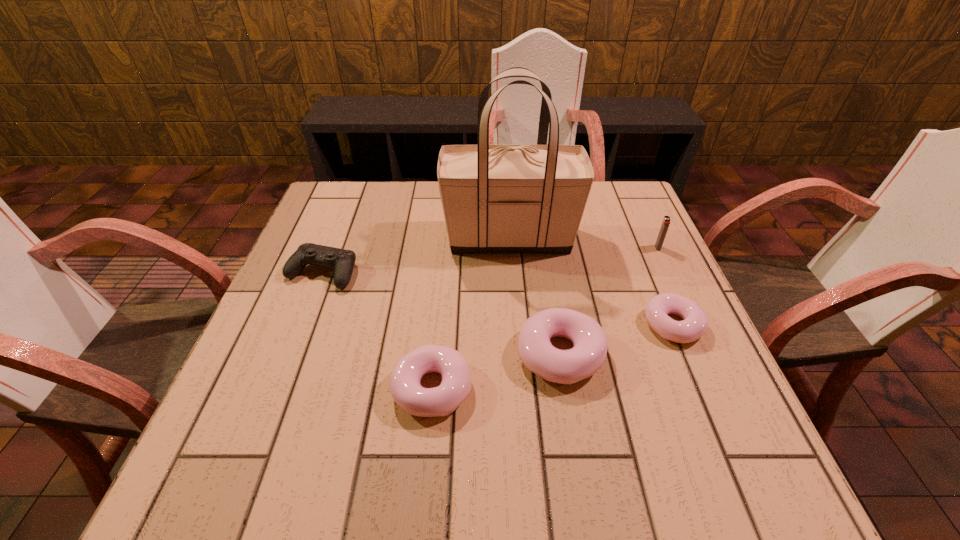
Where is `free space that satisfies the following two spatial constraints: 1. on the back side of the igniter; 2. with handles facing forward on the tallest object`? free space that satisfies the following two spatial constraints: 1. on the back side of the igniter; 2. with handles facing forward on the tallest object is located at coordinates (654, 239).

At what (x,y) coordinates should I click in order to perform the action: click on vacant region that satisfies the following two spatial constraints: 1. on the back side of the leftmost object; 2. on the right side of the fifth shortest object. Please return your answer as a coordinate pair (x, y). This screenshot has height=540, width=960. Looking at the image, I should click on (332, 248).